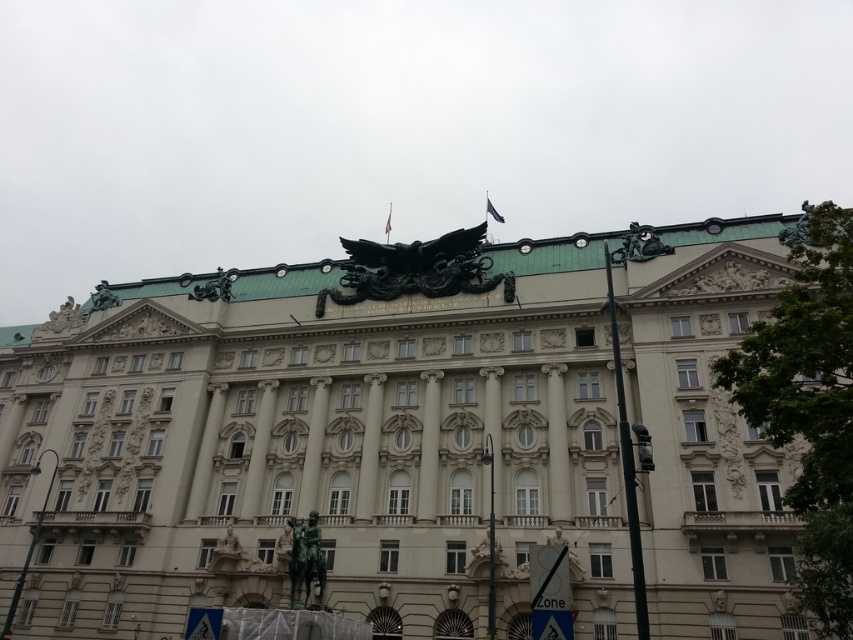
Question: Which point appears farthest from the camera in this image?

Choices:
 (A) (567, 324)
 (B) (196, 289)

Answer: (B)

Question: Does black polished eagle at center have a greater width compared to bronze/golden statue at upper left?

Choices:
 (A) no
 (B) yes

Answer: (A)

Question: Can you confirm if bronze statue at center is thinner than bronze/golden statue at upper left?

Choices:
 (A) yes
 (B) no

Answer: (A)

Question: Does white stone building at center have a greater width compared to black polished eagle at center?

Choices:
 (A) yes
 (B) no

Answer: (A)

Question: Which object is the farthest from the green stone sculpture at upper center?

Choices:
 (A) bronze/golden statue at upper left
 (B) black polished eagle at center

Answer: (A)

Question: Among these objects, which one is farthest from the camera?

Choices:
 (A) black polished eagle at center
 (B) white stone building at center
 (C) bronze/golden statue at upper left

Answer: (C)